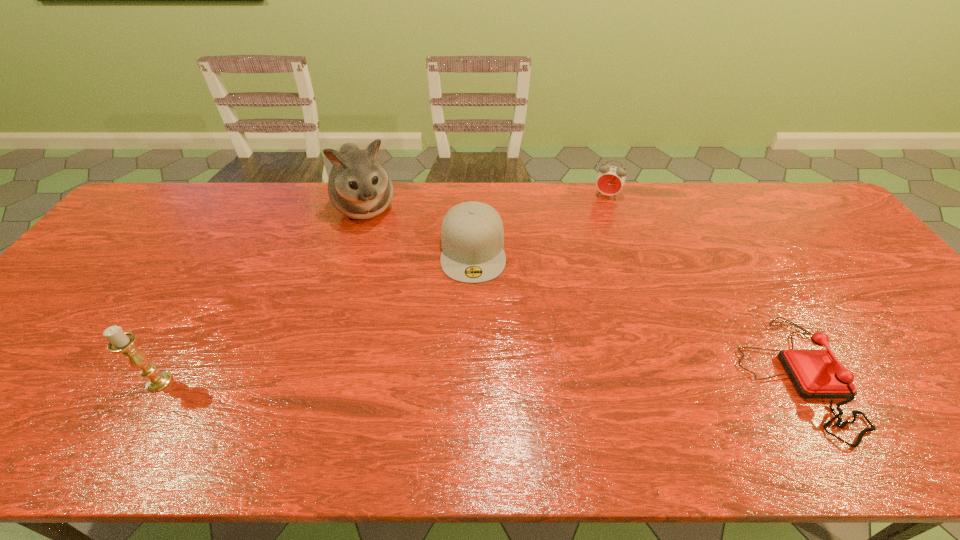
Where is `the fourth shortest object`? The image size is (960, 540). the fourth shortest object is located at coordinates (122, 342).

This screenshot has height=540, width=960. What are the coordinates of `candle holder` in the screenshot? It's located at (122, 342).

This screenshot has width=960, height=540. I want to click on telephone, so click(815, 373).

Image resolution: width=960 pixels, height=540 pixels. What are the coordinates of `the shortest object` in the screenshot? It's located at (815, 373).

The image size is (960, 540). What are the coordinates of `hamster` in the screenshot? It's located at pos(359,187).

At what (x,y) coordinates should I click in order to perform the action: click on the tallest object. Please return your answer as a coordinate pair (x, y). The image size is (960, 540). Looking at the image, I should click on (359, 187).

Locate an element on the screen. The height and width of the screenshot is (540, 960). the third tallest object is located at coordinates (610, 180).

Identify the location of alarm clock. (610, 180).

Identify the location of cap. Image resolution: width=960 pixels, height=540 pixels. 472,236.

Find the location of a particular element. The height and width of the screenshot is (540, 960). the second shortest object is located at coordinates (472, 236).